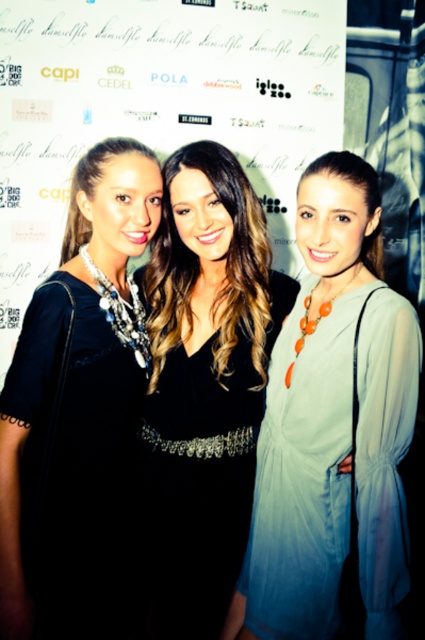
Question: Is white paper at center above black satin dress at center?

Choices:
 (A) no
 (B) yes

Answer: (B)

Question: Is white paper at center positioned behind black satin dress at center?

Choices:
 (A) yes
 (B) no

Answer: (A)

Question: Which point appears farthest from the camera in this image?

Choices:
 (A) (76, 337)
 (B) (254, 177)
 (C) (161, 326)
 (D) (311, 504)

Answer: (B)

Question: Which of these objects is positioned farthest from the black satin dress at center?

Choices:
 (A) white paper at center
 (B) matte blue dress at center
 (C) matte black dress at left

Answer: (A)

Question: Which object appears farthest from the camera in this image?

Choices:
 (A) black satin dress at center
 (B) matte black dress at left

Answer: (A)

Question: Can you confirm if black satin dress at center is thinner than matte black dress at left?

Choices:
 (A) no
 (B) yes

Answer: (A)